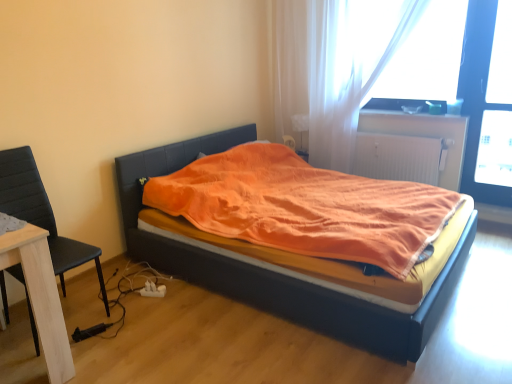
Question: Considering the relative sizes of transparent plastic window screen at upper right and black leather chair at left in the image provided, is transparent plastic window screen at upper right wider than black leather chair at left?

Choices:
 (A) yes
 (B) no

Answer: (B)

Question: From the image's perspective, would you say transparent plastic window screen at upper right is positioned over black leather chair at left?

Choices:
 (A) no
 (B) yes

Answer: (B)

Question: Is the depth of transparent plastic window screen at upper right less than that of black leather chair at left?

Choices:
 (A) no
 (B) yes

Answer: (A)

Question: From a real-world perspective, is transparent plastic window screen at upper right positioned under black leather chair at left based on gravity?

Choices:
 (A) yes
 (B) no

Answer: (B)

Question: Can you confirm if transparent plastic window screen at upper right is bigger than black leather chair at left?

Choices:
 (A) yes
 (B) no

Answer: (B)

Question: Is white textured radiator at upper right wider or thinner than black leather chair at left?

Choices:
 (A) thin
 (B) wide

Answer: (A)

Question: Is white textured radiator at upper right bigger or smaller than black leather chair at left?

Choices:
 (A) big
 (B) small

Answer: (B)

Question: Is white textured radiator at upper right taller or shorter than black leather chair at left?

Choices:
 (A) short
 (B) tall

Answer: (A)

Question: From the image's perspective, relative to black leather chair at left, is white textured radiator at upper right above or below?

Choices:
 (A) above
 (B) below

Answer: (A)

Question: Is transparent plastic window screen at upper right inside the boundaries of translucent fabric curtain at upper right, or outside?

Choices:
 (A) outside
 (B) inside

Answer: (A)

Question: Considering their positions, is transparent plastic window screen at upper right located in front of or behind translucent fabric curtain at upper right?

Choices:
 (A) front
 (B) behind

Answer: (B)

Question: Considering the positions of transparent plastic window screen at upper right and translucent fabric curtain at upper right in the image, is transparent plastic window screen at upper right wider or thinner than translucent fabric curtain at upper right?

Choices:
 (A) wide
 (B) thin

Answer: (B)

Question: Is point (414, 96) positioned closer to the camera than point (284, 9)?

Choices:
 (A) farther
 (B) closer

Answer: (B)

Question: Considering the relative positions of orange fabric bed at center and white textured radiator at upper right in the image provided, is orange fabric bed at center to the left or to the right of white textured radiator at upper right?

Choices:
 (A) left
 (B) right

Answer: (A)

Question: Is point (273, 304) positioned closer to the camera than point (442, 155)?

Choices:
 (A) closer
 (B) farther

Answer: (A)